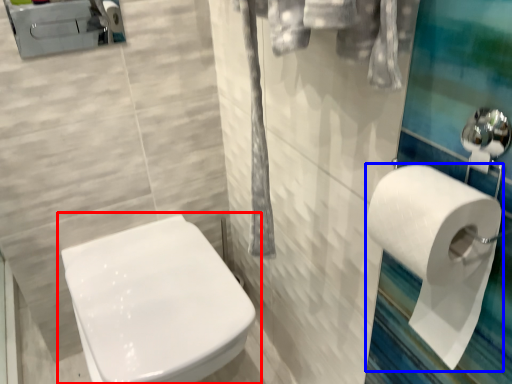
Question: Which object appears farthest to the camera in this image, toilet (highlighted by a red box) or toilet paper (highlighted by a blue box)?

Choices:
 (A) toilet
 (B) toilet paper

Answer: (A)